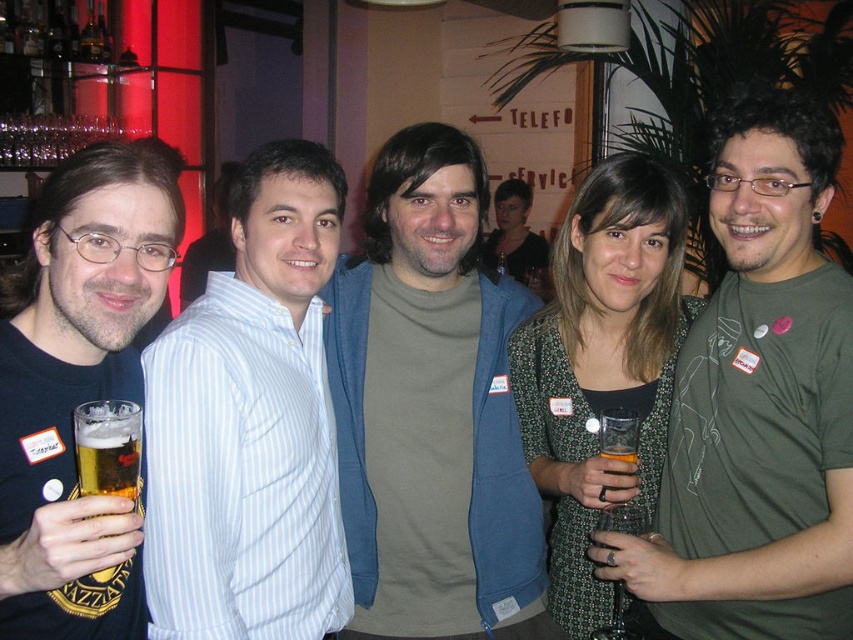
Question: Which of these objects is positioned closest to the translucent glass beer at center?

Choices:
 (A) white striped shirt at center
 (B) matte black t-shirt at left

Answer: (A)

Question: Can you confirm if green matte shirt at center is positioned below white striped shirt at center?

Choices:
 (A) yes
 (B) no

Answer: (B)

Question: From the image, what is the correct spatial relationship of white striped shirt at center in relation to translucent glass beer at center?

Choices:
 (A) above
 (B) below

Answer: (A)

Question: Which of the following is the farthest from the observer?

Choices:
 (A) (606, 451)
 (B) (70, 307)

Answer: (A)

Question: Which object appears closest to the camera in this image?

Choices:
 (A) white striped shirt at center
 (B) translucent glass beer at center

Answer: (A)

Question: Is green matte shirt at center further to the viewer compared to white striped shirt at center?

Choices:
 (A) no
 (B) yes

Answer: (A)